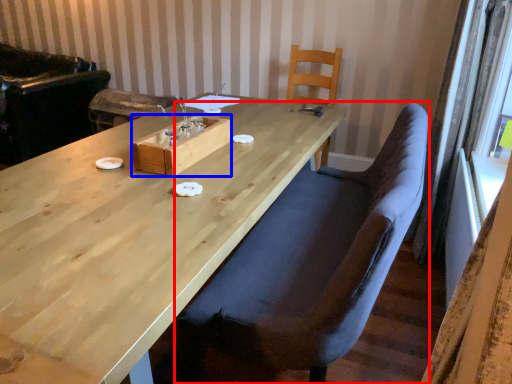
Question: Which object appears farthest to the camera in this image, chair (highlighted by a red box) or wood (highlighted by a blue box)?

Choices:
 (A) chair
 (B) wood

Answer: (B)